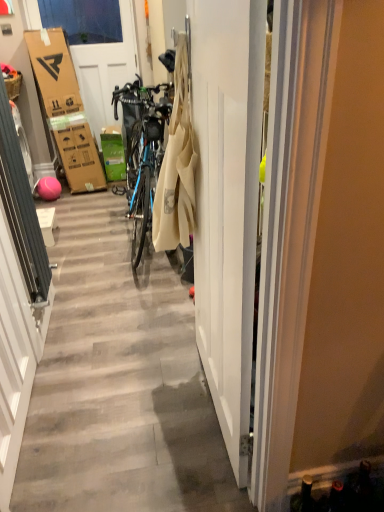
This screenshot has height=512, width=384. Describe the element at coordinates (227, 203) in the screenshot. I see `white glossy door at center, the first door positioned from the front` at that location.

Describe the element at coordinates (97, 51) in the screenshot. I see `white cardboard at upper left, positioned as the first door in back-to-front order` at that location.

What do you see at coordinates (120, 382) in the screenshot? I see `matte blue bicycle at center` at bounding box center [120, 382].

Identify the location of white glossy door at center, the first door positioned from the front. (227, 203).

Who is shorter, white glossy door at center, which is the 2th door in left-to-right order, or white cardboard at upper left, which appears as the 2th door when viewed from the right?

white glossy door at center, which is the 2th door in left-to-right order.

Considering the sizes of white glossy door at center, arranged as the 1th door when ordered from the bottom, and white cardboard at upper left, which ranks as the first door in left-to-right order, in the image, is white glossy door at center, arranged as the 1th door when ordered from the bottom, bigger or smaller than white cardboard at upper left, which ranks as the first door in left-to-right order,?

Clearly, white glossy door at center, arranged as the 1th door when ordered from the bottom, is larger in size than white cardboard at upper left, which ranks as the first door in left-to-right order.

Is white glossy door at center, the first door positioned from the front, oriented away from white cardboard at upper left, positioned as the 2th door in bottom-to-top order?

white glossy door at center, the first door positioned from the front, does not have its back to white cardboard at upper left, positioned as the 2th door in bottom-to-top order.

Is white glossy door at center, which is the 2th door in left-to-right order, in front of or behind white cardboard at upper left, which ranks as the first door in left-to-right order, in the image?

white glossy door at center, which is the 2th door in left-to-right order, is in front of white cardboard at upper left, which ranks as the first door in left-to-right order.

Locate an element on the screen. This screenshot has height=512, width=384. path below the matte brown picnic basket at left (from a real-world perspective) is located at coordinates (120, 382).

Would you say matte blue bicycle at center is to the left or to the right of matte brown picnic basket at left in the picture?

Based on their positions, matte blue bicycle at center is located to the right of matte brown picnic basket at left.

Identify the location of door above the matte brown picnic basket at left (from the image's perspective). (97, 51).

Is matte brown picnic basket at left taller or shorter than white cardboard at upper left, which ranks as the first door in left-to-right order?

In the image, matte brown picnic basket at left appears to be shorter than white cardboard at upper left, which ranks as the first door in left-to-right order.

Is matte brown picnic basket at left inside or outside of white cardboard at upper left, positioned as the 2th door in bottom-to-top order?

matte brown picnic basket at left cannot be found inside white cardboard at upper left, positioned as the 2th door in bottom-to-top order.

Between matte brown picnic basket at left and white cardboard at upper left, positioned as the 2th door in bottom-to-top order, which one has smaller size?

matte brown picnic basket at left is smaller.

From the image's perspective, between matte blue bicycle at center and white glossy door at center, the first door positioned from the front, which one is located above?

white glossy door at center, the first door positioned from the front.

Is matte blue bicycle at center positioned beyond the bounds of white glossy door at center, which is counted as the 2th door, starting from the back?

Yes, matte blue bicycle at center is not within white glossy door at center, which is counted as the 2th door, starting from the back.

Between matte blue bicycle at center and white glossy door at center, arranged as the 1th door when ordered from the bottom, which one appears on the left side from the viewer's perspective?

From the viewer's perspective, matte blue bicycle at center appears more on the left side.

Considering the positions of objects white glossy door at center, arranged as the 1th door when ordered from the bottom, and matte blue bicycle at center in the image provided, who is more to the right, white glossy door at center, arranged as the 1th door when ordered from the bottom, or matte blue bicycle at center?

Positioned to the right is white glossy door at center, arranged as the 1th door when ordered from the bottom.

Can you confirm if white glossy door at center, the first door positioned from the front, is shorter than matte blue bicycle at center?

Correct, white glossy door at center, the first door positioned from the front, is not as tall as matte blue bicycle at center.

There is a matte blue bicycle at center. Where is `the 1st door above it (from a real-world perspective)`? the 1st door above it (from a real-world perspective) is located at coordinates (227, 203).

Which of these two, white glossy door at center, which is the 2th door in left-to-right order, or matte blue bicycle at center, is thinner?

With smaller width is white glossy door at center, which is the 2th door in left-to-right order.

In the scene shown: Between white cardboard at upper left, acting as the 1th door starting from the top, and white glossy door at center, which is the 2th door in left-to-right order, which one has larger width?

white glossy door at center, which is the 2th door in left-to-right order.

Does white cardboard at upper left, which ranks as the first door in left-to-right order, have a smaller size compared to white glossy door at center, marked as the first door in a right-to-left arrangement?

Indeed, white cardboard at upper left, which ranks as the first door in left-to-right order, has a smaller size compared to white glossy door at center, marked as the first door in a right-to-left arrangement.

Could you tell me if white cardboard at upper left, acting as the second door starting from the front, is turned towards white glossy door at center, which is counted as the 2th door, starting from the back?

Yes, white cardboard at upper left, acting as the second door starting from the front, is facing white glossy door at center, which is counted as the 2th door, starting from the back.

Is the surface of white cardboard at upper left, which ranks as the first door in left-to-right order, in direct contact with matte brown picnic basket at left?

No.

Between white cardboard at upper left, which appears as the 2th door when viewed from the right, and matte brown picnic basket at left, which one appears on the left side from the viewer's perspective?

matte brown picnic basket at left is more to the left.

How much distance is there between white cardboard at upper left, which appears as the 2th door when viewed from the right, and matte brown picnic basket at left?

They are 7.22 feet apart.

Which object is more forward, white cardboard at upper left, which appears as the 2th door when viewed from the right, or matte brown picnic basket at left?

matte brown picnic basket at left is in front.

Where is `door below the white cardboard at upper left, which ranks as the first door in left-to-right order (from the image's perspective)`? door below the white cardboard at upper left, which ranks as the first door in left-to-right order (from the image's perspective) is located at coordinates (227, 203).

This screenshot has width=384, height=512. Identify the location of path that appears on the right of matte brown picnic basket at left. (120, 382).

From the image, which object appears to be farther from matte brown picnic basket at left, white glossy door at center, the first door positioned from the front, or white cardboard at upper left, which appears as the 2th door when viewed from the right?

white cardboard at upper left, which appears as the 2th door when viewed from the right, lies further to matte brown picnic basket at left than the other object.

When comparing their distances from white glossy door at center, arranged as the 1th door when ordered from the bottom, does matte brown picnic basket at left or white cardboard at upper left, acting as the 1th door starting from the top, seem further?

white cardboard at upper left, acting as the 1th door starting from the top, is further to white glossy door at center, arranged as the 1th door when ordered from the bottom.

Based on their spatial positions, is matte blue bicycle at center or matte brown picnic basket at left closer to white cardboard at upper left, positioned as the 2th door in bottom-to-top order?

matte brown picnic basket at left is closer to white cardboard at upper left, positioned as the 2th door in bottom-to-top order.

When comparing their distances from matte brown picnic basket at left, does matte blue bicycle at center or white glossy door at center, which is the 2th door in left-to-right order, seem further?

matte blue bicycle at center is positioned further to the anchor matte brown picnic basket at left.

Estimate the real-world distances between objects in this image. Which object is closer to matte blue bicycle at center, white glossy door at center, the first door positioned from the front, or matte brown picnic basket at left?

Among the two, white glossy door at center, the first door positioned from the front, is located nearer to matte blue bicycle at center.

Considering their positions, is matte brown picnic basket at left positioned further to matte blue bicycle at center than white cardboard at upper left, acting as the 1th door starting from the top?

white cardboard at upper left, acting as the 1th door starting from the top.

Estimate the real-world distances between objects in this image. Which object is further from matte brown picnic basket at left, white glossy door at center, the 2th door viewed from the top, or matte blue bicycle at center?

matte blue bicycle at center lies further to matte brown picnic basket at left than the other object.

When comparing their distances from white cardboard at upper left, acting as the second door starting from the front, does white glossy door at center, which is the 2th door in left-to-right order, or matte blue bicycle at center seem closer?

The object closer to white cardboard at upper left, acting as the second door starting from the front, is matte blue bicycle at center.

The image size is (384, 512). I want to click on door between matte blue bicycle at center and white cardboard at upper left, acting as the second door starting from the front, in the front-back direction, so click(227, 203).

Find the location of a particular element. The image size is (384, 512). picnic basket between matte blue bicycle at center and white cardboard at upper left, which ranks as the first door in left-to-right order, in the front-back direction is located at coordinates (13, 85).

Find the location of a particular element. Image resolution: width=384 pixels, height=512 pixels. picnic basket located between white glossy door at center, the first door positioned from the front, and white cardboard at upper left, which appears as the 2th door when viewed from the right, in the depth direction is located at coordinates (13, 85).

Identify the location of door positioned between matte blue bicycle at center and matte brown picnic basket at left from near to far. [227, 203].